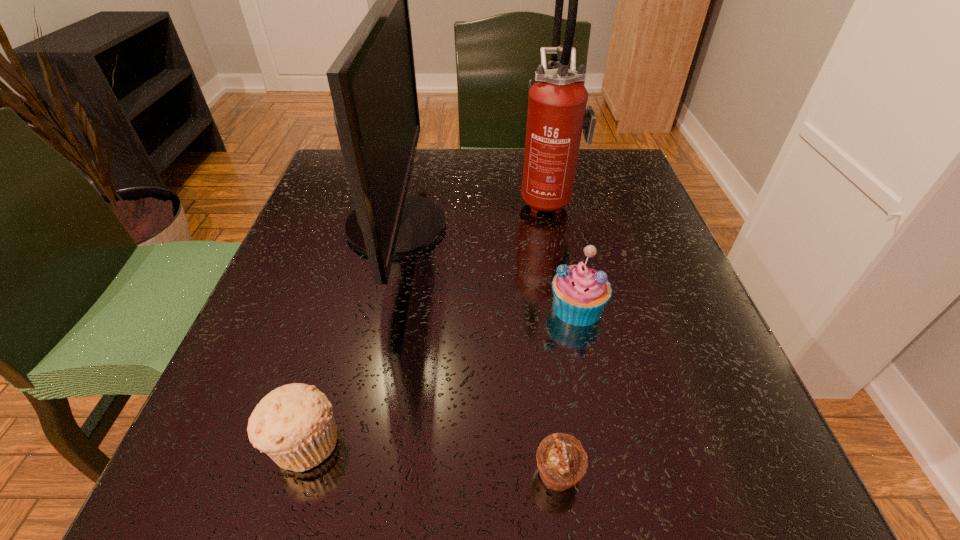
Locate an element on the screen. This screenshot has height=540, width=960. fire extinguisher is located at coordinates (557, 113).

Where is `monitor`? This screenshot has height=540, width=960. monitor is located at coordinates (372, 81).

The image size is (960, 540). What are the coordinates of `the farthest muffin` in the screenshot? It's located at (580, 293).

At what (x,y) coordinates should I click in order to perform the action: click on the leftmost muffin. Please return your answer as a coordinate pair (x, y). Looking at the image, I should click on (294, 425).

You are a GUI agent. You are given a task and a screenshot of the screen. Output one action in this format:
    pyautogui.click(x=<x>, y=<y>)
    Task: Click on the vacant space located 0.120m at the nozzle of the fire extinguisher
    
    Given the screenshot: What is the action you would take?
    pyautogui.click(x=465, y=199)

Identify the location of vacant position located at the nozzle of the fire extinguisher. (423, 199).

The image size is (960, 540). Find the location of `free space located at the nozzle of the fire extinguisher`. free space located at the nozzle of the fire extinguisher is located at coordinates (415, 199).

I want to click on free space located on the screen side of the monitor, so click(535, 226).

The image size is (960, 540). I want to click on vacant region located 0.220m on the left of the farthest muffin, so click(x=417, y=307).

Find the location of `free space located on the back of the leftmost muffin`. free space located on the back of the leftmost muffin is located at coordinates (347, 301).